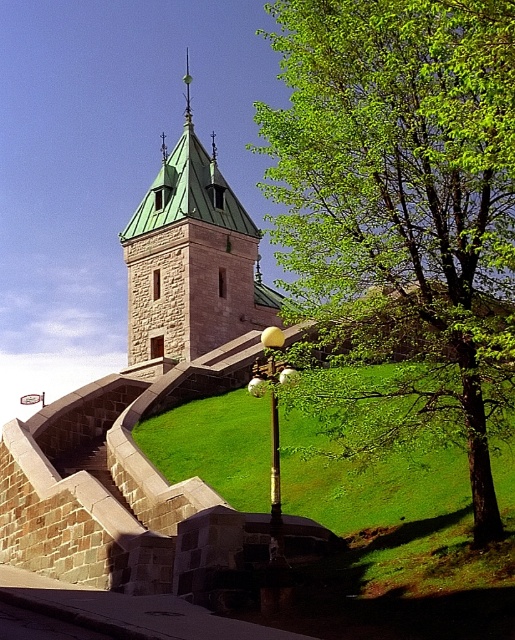
Question: Is green grass at center to the left of green stone tower at center from the viewer's perspective?

Choices:
 (A) yes
 (B) no

Answer: (B)

Question: Does green leafy tree at right appear under green grass at center?

Choices:
 (A) no
 (B) yes

Answer: (A)

Question: Which object is positioned closest to the green leafy tree at right?

Choices:
 (A) green grass at center
 (B) green stone tower at center

Answer: (A)

Question: Estimate the real-world distances between objects in this image. Which object is farther from the green stone tower at center?

Choices:
 (A) green leafy tree at right
 (B) green grass at center

Answer: (A)

Question: Considering the real-world distances, which object is farthest from the green leafy tree at right?

Choices:
 (A) green grass at center
 (B) green stone tower at center

Answer: (B)

Question: Can you confirm if green leafy tree at right is smaller than green stone tower at center?

Choices:
 (A) yes
 (B) no

Answer: (B)